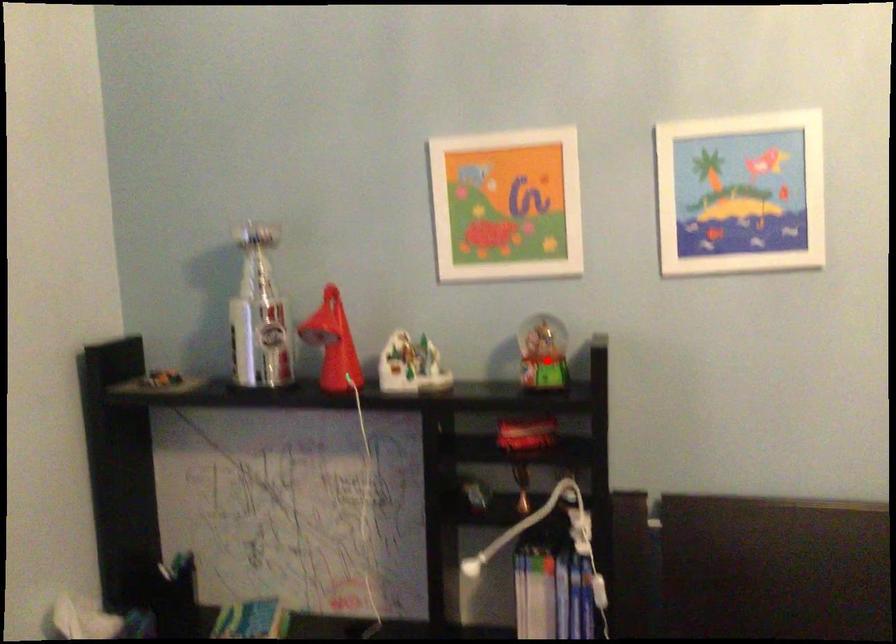
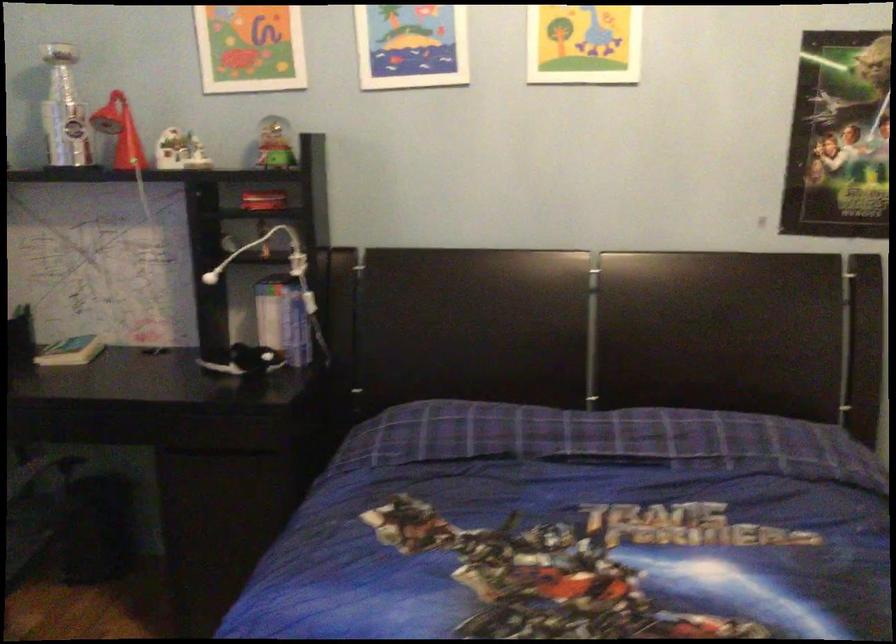
The point at the highlighted location is marked in the first image. Where is the corresponding point in the second image?

(273, 144)